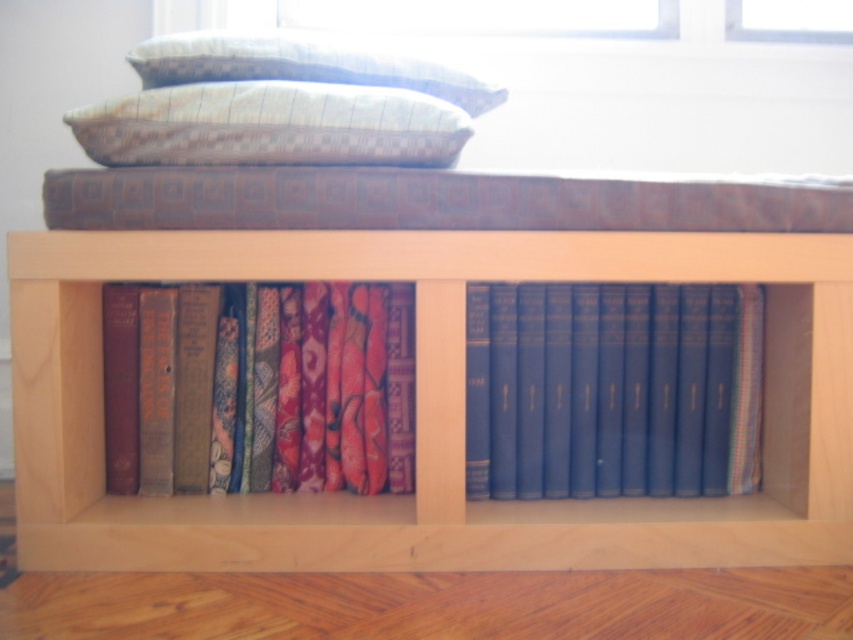
You are standing in front of the wooden shelf unit and want to place a new book on the shelf. You have two options for placement based on coordinates given as points. The first point is at coordinates point [514,339] and the second is at point [151,54]. Which point is closer to you, and therefore a better option for placing the book?

Point [514,339] is in front of point [151,54], so it is closer to you and a better option for placing the book.

You are trying to determine if the blue hardcover books at center can fit into a storage box designed for items as thick as the patterned fabric pillow at upper center. Based on their thickness, will they fit?

The blue hardcover books at center are thinner than the patterned fabric pillow at upper center, so they will fit into the storage box designed for the pillow.

You are organizing a bookshelf and notice the multicolored fabric at center and the blue hardcover books at center. Which item is positioned higher on the shelf?

The multicolored fabric at center is positioned higher than the blue hardcover books at center because it is located above them.